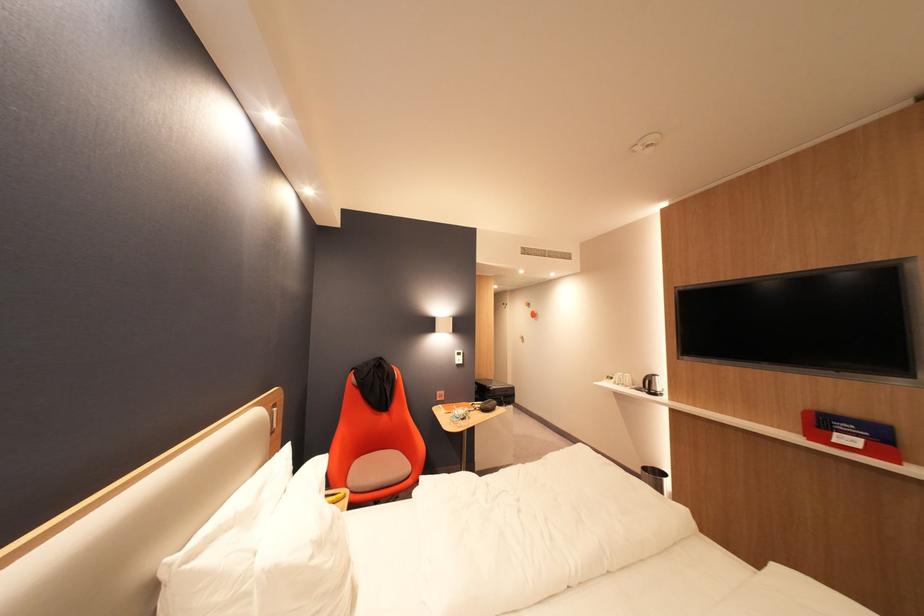
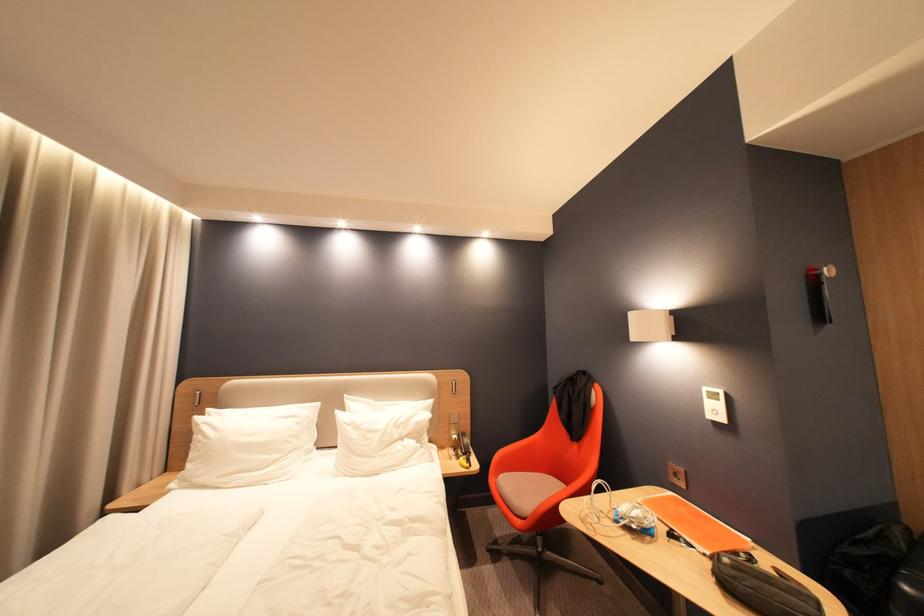
Locate, in the second image, the point that corresponds to point (468, 361) in the first image.

(724, 413)